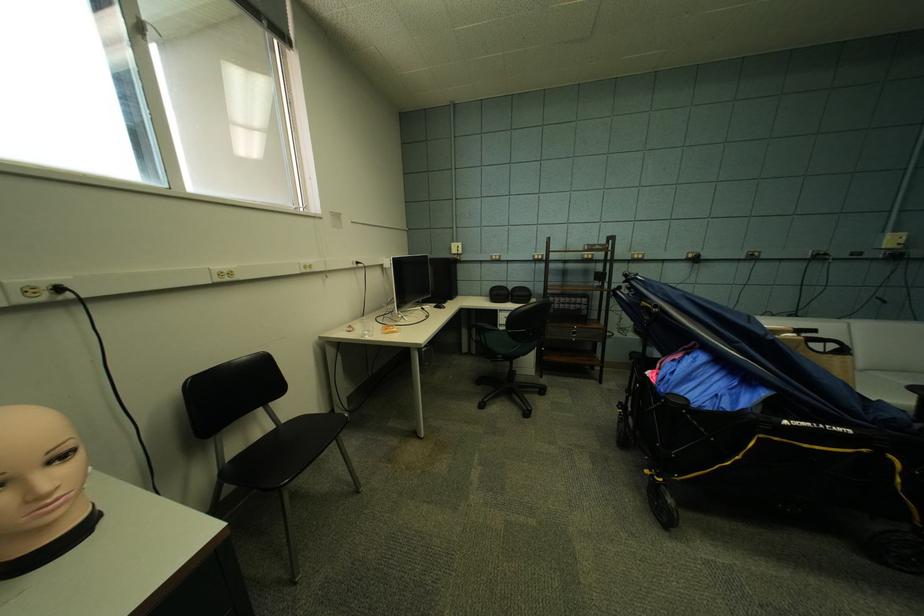
Where would you drinking_from the glass cup? Please return your answer as a coordinate pair (x, y).

(366, 326)